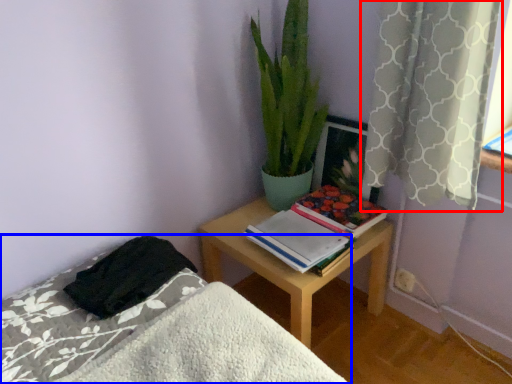
Question: Which object appears farthest to the camera in this image, curtain (highlighted by a red box) or bed (highlighted by a blue box)?

Choices:
 (A) curtain
 (B) bed

Answer: (A)